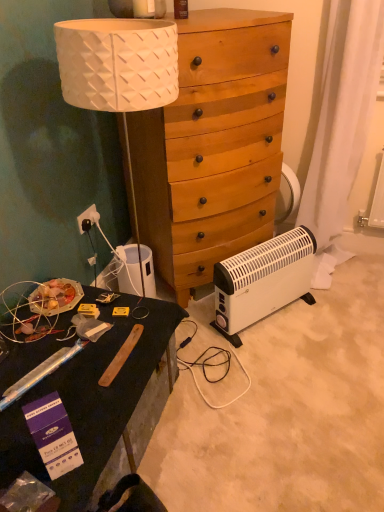
Find the location of a particular element. free location to the right of white plastic radiator at lower right is located at coordinates (329, 331).